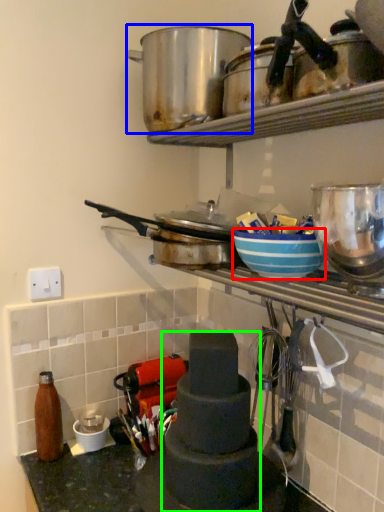
Question: Considering the real-world distances, which object is farthest from bowl (highlighted by a red box)? crock pot (highlighted by a blue box) or appliance (highlighted by a green box)?

Choices:
 (A) crock pot
 (B) appliance

Answer: (A)